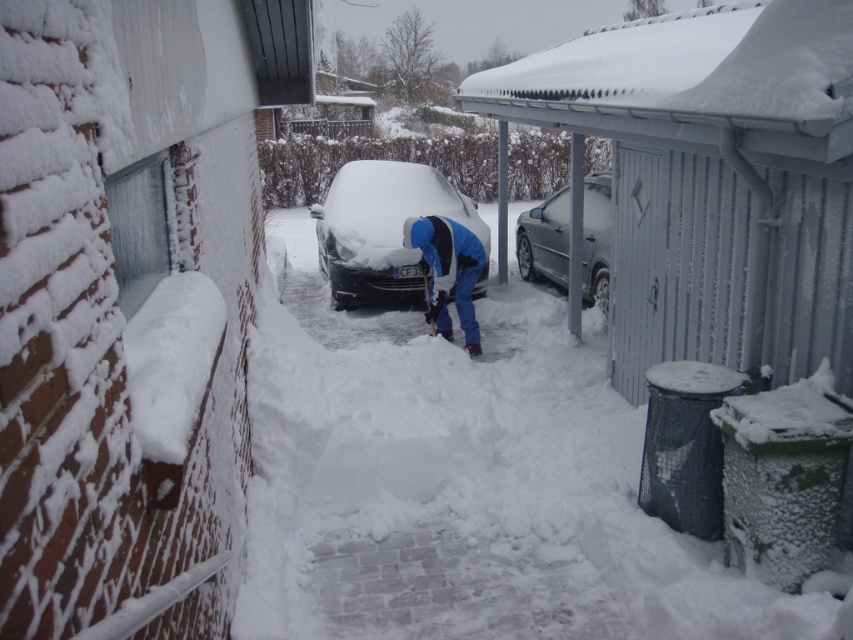
Question: Among these points, which one is nearest to the camera?

Choices:
 (A) (531, 618)
 (B) (460, 324)
 (C) (537, 218)
 (D) (413, 179)

Answer: (A)

Question: Is shiny black car at center above metallic gray sedan at center?

Choices:
 (A) no
 (B) yes

Answer: (A)

Question: Which object appears farthest from the camera in this image?

Choices:
 (A) blue fabric jacket at center
 (B) white fluffy snow at center
 (C) shiny black car at center
 (D) metallic gray sedan at center

Answer: (D)

Question: Can you confirm if shiny black car at center is positioned above blue fabric jacket at center?

Choices:
 (A) yes
 (B) no

Answer: (A)

Question: Which object is closer to the camera taking this photo?

Choices:
 (A) white fluffy snow at center
 (B) metallic gray sedan at center
 (C) blue fabric jacket at center
 (D) shiny black car at center

Answer: (A)

Question: Does white fluffy snow at center come behind shiny black car at center?

Choices:
 (A) yes
 (B) no

Answer: (B)